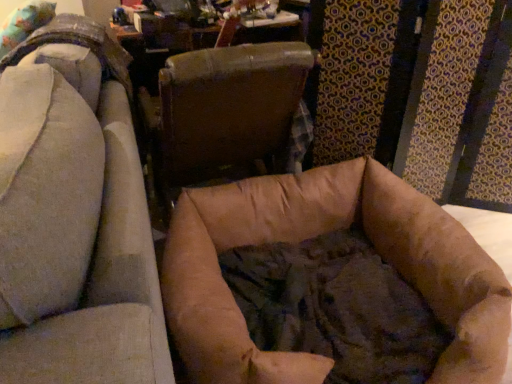
Question: Considering their positions, is brown leather chair at center, the second chair positioned from the left, located in front of or behind brown fabric dog bed at center, positioned as the 2th chair in right-to-left order?

Choices:
 (A) front
 (B) behind

Answer: (B)

Question: From the image's perspective, is brown leather chair at center, the second chair positioned from the left, located above or below brown fabric dog bed at center, acting as the 1th chair starting from the left?

Choices:
 (A) above
 (B) below

Answer: (A)

Question: Does point (157, 139) appear closer or farther from the camera than point (129, 321)?

Choices:
 (A) closer
 (B) farther

Answer: (B)

Question: Is brown fabric dog bed at center, acting as the 1th chair starting from the left, to the left or to the right of brown leather chair at center, arranged as the first chair when viewed from the right, in the image?

Choices:
 (A) left
 (B) right

Answer: (A)

Question: From the image's perspective, relative to brown leather chair at center, the second chair positioned from the left, is brown fabric dog bed at center, acting as the 1th chair starting from the left, above or below?

Choices:
 (A) below
 (B) above

Answer: (A)

Question: In the image, is brown fabric dog bed at center, acting as the 1th chair starting from the left, positioned in front of or behind brown leather chair at center, arranged as the first chair when viewed from the right?

Choices:
 (A) front
 (B) behind

Answer: (A)

Question: In terms of size, does brown fabric dog bed at center, positioned as the 2th chair in right-to-left order, appear bigger or smaller than brown leather chair at center, the second chair positioned from the left?

Choices:
 (A) big
 (B) small

Answer: (A)